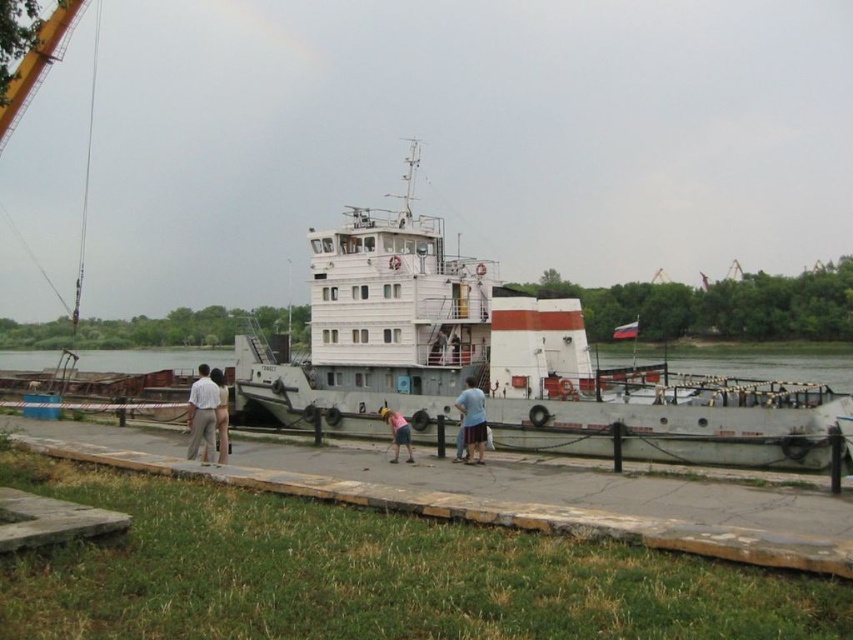
Find the location of a particular element. This screenshot has width=853, height=640. white cotton shirt at left is located at coordinates coord(202,413).

In the scene shown: Is white cotton shirt at left smaller than nude skin at center?

No.

Locate an element on the screen. This screenshot has width=853, height=640. white cotton shirt at left is located at coordinates (202, 413).

Can you confirm if white matte barge at center is taller than pink fabric shorts at center?

Yes, white matte barge at center is taller than pink fabric shorts at center.

At what (x,y) coordinates should I click in order to perform the action: click on white matte barge at center. Please return your answer as a coordinate pair (x, y). This screenshot has width=853, height=640. Looking at the image, I should click on (492, 358).

Can you confirm if white cotton shirt at left is positioned above blue cotton shirt at center?

No.

Can you confirm if white cotton shirt at left is thinner than blue cotton shirt at center?

No.

Describe the element at coordinates (202, 413) in the screenshot. The height and width of the screenshot is (640, 853). I see `white cotton shirt at left` at that location.

At what (x,y) coordinates should I click in order to perform the action: click on white cotton shirt at left. Please return your answer as a coordinate pair (x, y). Image resolution: width=853 pixels, height=640 pixels. Looking at the image, I should click on (202, 413).